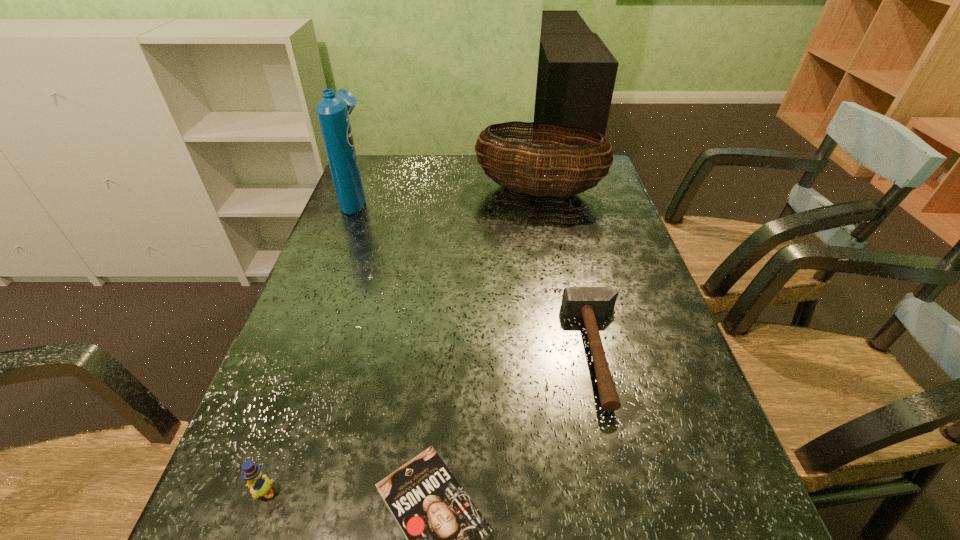
Locate an element on the screen. The image size is (960, 540). shampoo located in the far edge section of the desktop is located at coordinates (333, 110).

Identify the location of basket at the far edge. (499, 157).

You are a GUI agent. You are given a task and a screenshot of the screen. Output one action in this format:
    pyautogui.click(x=<x>, y=<y>)
    Task: Click on the shampoo at the left edge
    
    Given the screenshot: What is the action you would take?
    (x=333, y=110)

This screenshot has height=540, width=960. I want to click on duckling present at the left edge, so click(259, 485).

Where is `basket at the right edge`? basket at the right edge is located at coordinates (499, 157).

Find the location of a particular element. Image resolution: width=960 pixels, height=540 pixels. hammer that is at the right edge is located at coordinates (588, 302).

The height and width of the screenshot is (540, 960). I want to click on object present at the far left corner, so click(x=333, y=110).

You are a GUI agent. You are given a task and a screenshot of the screen. Output one action in this format:
    pyautogui.click(x=<x>, y=<y>)
    Task: Click on the object that is at the far right corner
    
    Given the screenshot: What is the action you would take?
    pyautogui.click(x=499, y=157)

Identify the location of vacant space at the far edge of the desktop. Image resolution: width=960 pixels, height=540 pixels. (433, 175).

Find the location of a particular element. The height and width of the screenshot is (540, 960). vacant space at the left edge of the desktop is located at coordinates (360, 218).